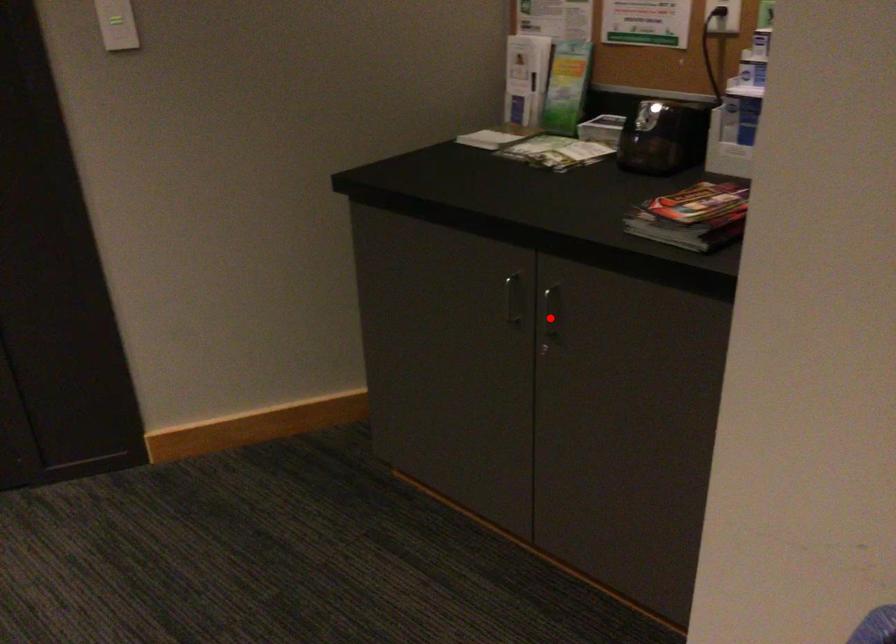
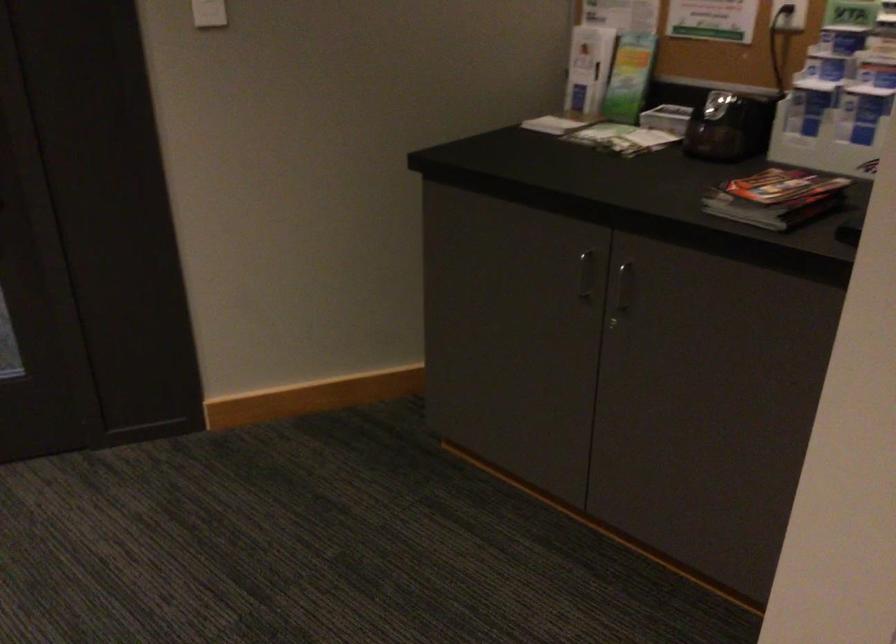
The point at the highlighted location is marked in the first image. Where is the corresponding point in the second image?

(622, 292)